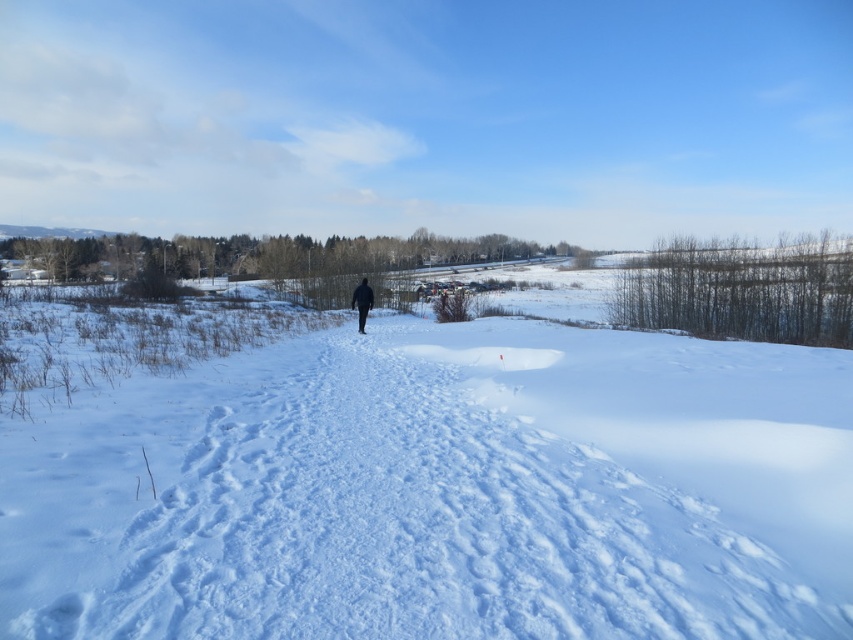
You are standing at the point labeled point (360, 321) and want to walk to the point labeled point (502, 369). Which direction should you move relative to your current position?

You should move forward because point (502, 369) is closer to the viewer than point (360, 321), meaning it is physically located in front of your current position.

You are standing at the edge of the snow path and want to walk towards the dark blue jacket at center. Which direction should you go to step onto the white fluffy snow at center first?

You should walk towards the dark blue jacket at center because the white fluffy snow at center is closer to you than the dark blue jacket at center, so stepping onto the white fluffy snow at center first would be on the path towards the jacket.